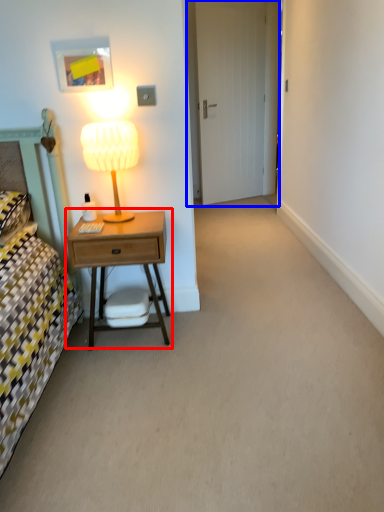
Question: Which of the following is the farthest to the observer, nightstand (highlighted by a red box) or door (highlighted by a blue box)?

Choices:
 (A) nightstand
 (B) door

Answer: (B)